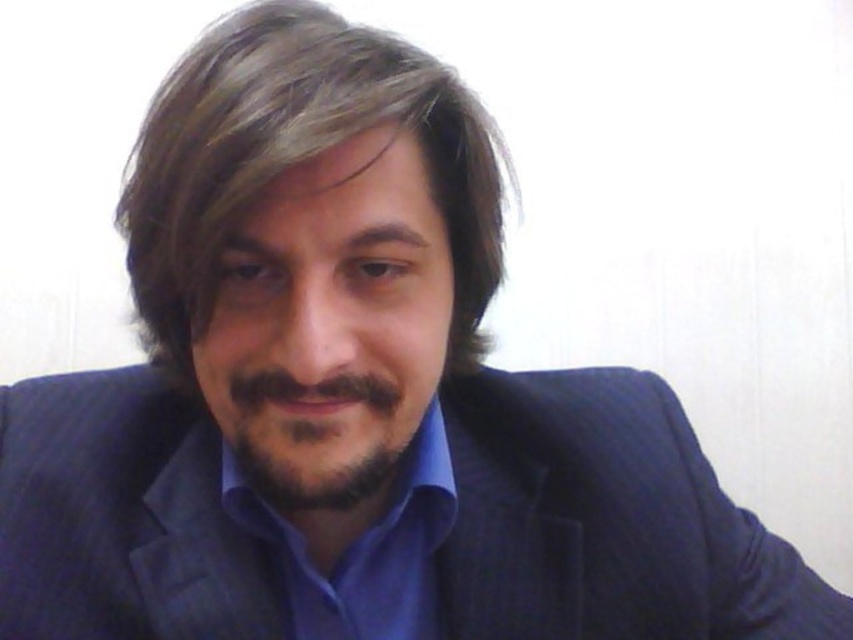
Question: Which of the following is the farthest from the observer?

Choices:
 (A) (173, 276)
 (B) (590, 467)
 (C) (379, 429)

Answer: (B)

Question: Is brownsmoothhair at center below dark brown stubble at center?

Choices:
 (A) yes
 (B) no

Answer: (B)

Question: Which point is closer to the camera taking this photo?

Choices:
 (A) (161, 237)
 (B) (39, 627)
 (C) (325, 600)
 (D) (286, 381)

Answer: (D)

Question: Which point appears farthest from the camera in this image?

Choices:
 (A) (416, 72)
 (B) (172, 496)
 (C) (434, 458)
 (D) (289, 419)

Answer: (B)

Question: From the image, what is the correct spatial relationship of blue smooth shirt at center in relation to dark brown stubble at center?

Choices:
 (A) below
 (B) above

Answer: (A)

Question: Does dark blue textured suit at center have a lesser width compared to brownsmoothhair at center?

Choices:
 (A) yes
 (B) no

Answer: (B)